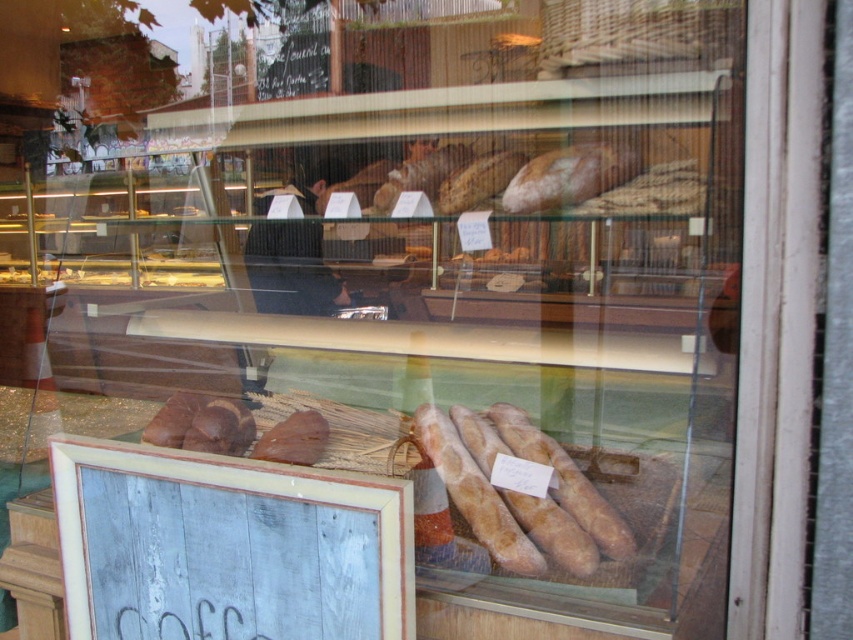
Does golden brown crusty baguette at center have a smaller size compared to brown matte bread at center?

Incorrect, golden brown crusty baguette at center is not smaller in size than brown matte bread at center.

Is point (519, 436) farther from viewer compared to point (285, 422)?

No, (519, 436) is in front of (285, 422).

Find the location of `golden brown crusty baguette at center`. golden brown crusty baguette at center is located at coordinates (520, 492).

Can you confirm if wooden signboard at lower left is positioned below golden brown crusty baguette at center?

Indeed, wooden signboard at lower left is positioned under golden brown crusty baguette at center.

Is wooden signboard at lower left bigger than golden brown crusty baguette at center?

Correct, wooden signboard at lower left is larger in size than golden brown crusty baguette at center.

Identify the location of wooden signboard at lower left. The width and height of the screenshot is (853, 640). (227, 547).

Identify the location of wooden signboard at lower left. (227, 547).

Between point (343, 577) and point (289, 435), which one is positioned in front?

Positioned in front is point (343, 577).

Between wooden signboard at lower left and brown matte bread at center, which one is positioned higher?

brown matte bread at center is higher up.

Locate an element on the screen. The width and height of the screenshot is (853, 640). wooden signboard at lower left is located at coordinates (227, 547).